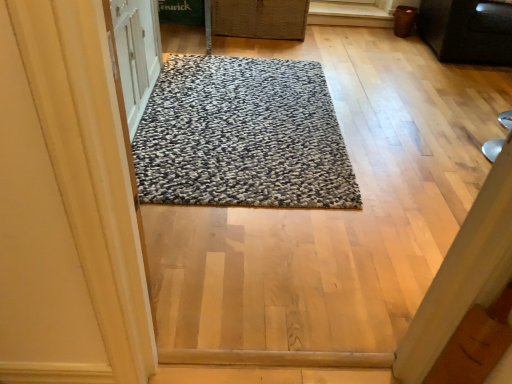
Identify the location of free spot above textured gray rug at center (from a real-world perspective). (219, 114).